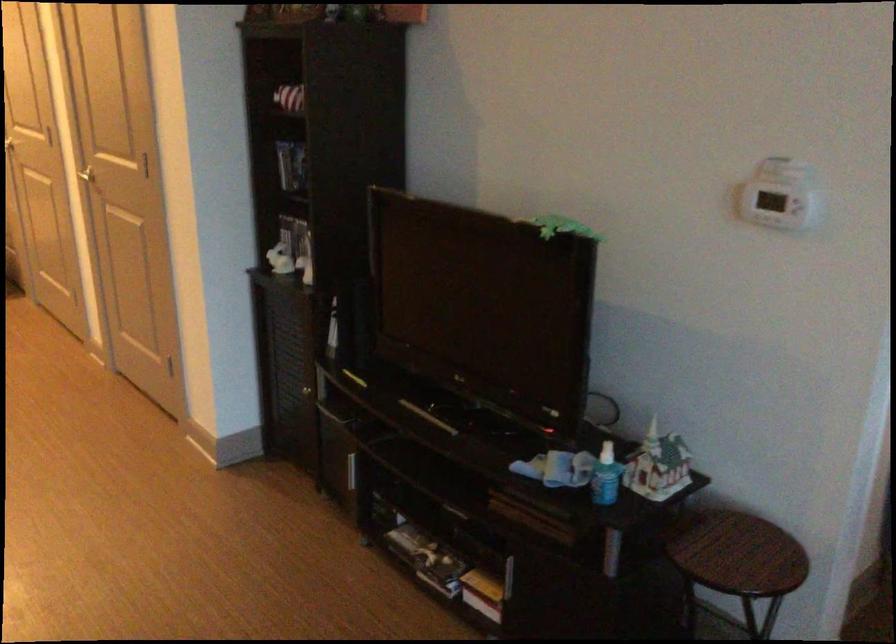
Where is `small cabinet handle`? small cabinet handle is located at coordinates (392, 381).